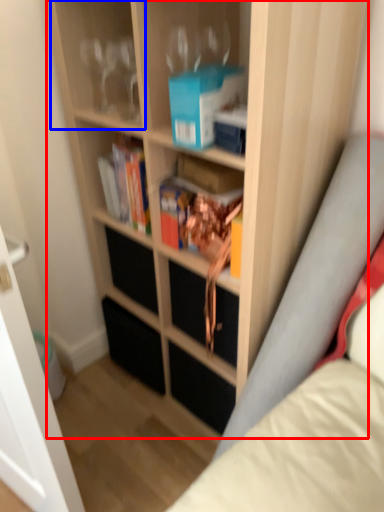
Question: Which object appears farthest to the camera in this image, bookcase (highlighted by a red box) or shelf (highlighted by a blue box)?

Choices:
 (A) bookcase
 (B) shelf

Answer: (B)